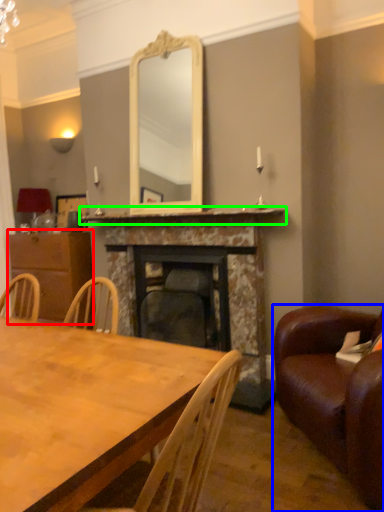
Question: Estimate the real-world distances between objects in this image. Which object is closer to cabinetry (highlighted by a red box), studio couch (highlighted by a blue box) or mantle (highlighted by a green box)?

Choices:
 (A) studio couch
 (B) mantle

Answer: (B)